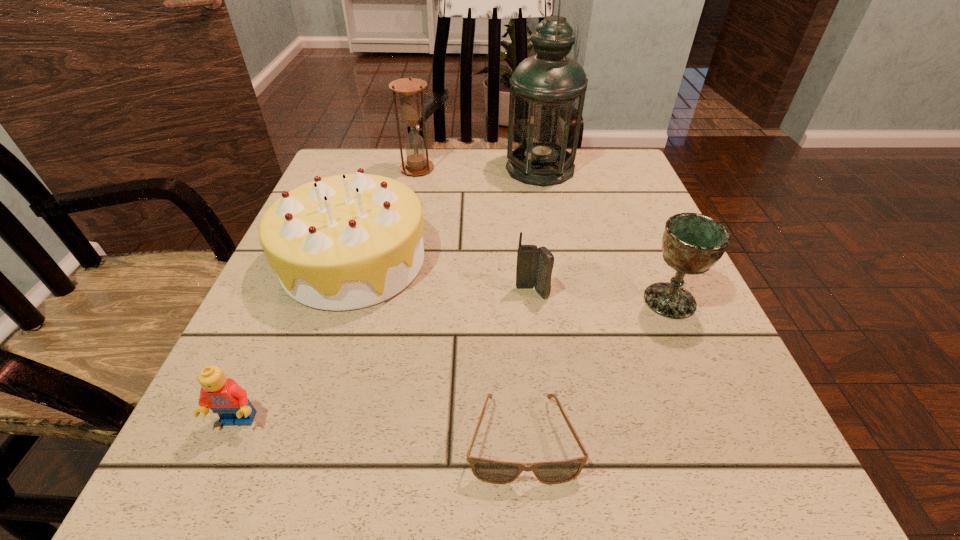
Locate an element on the screen. object that is positioned at the far right corner is located at coordinates (547, 93).

Where is `vacant space at the far edge of the desktop`? This screenshot has height=540, width=960. vacant space at the far edge of the desktop is located at coordinates (430, 156).

I want to click on vacant space at the near edge, so click(x=314, y=485).

This screenshot has height=540, width=960. Identify the location of free space at the right edge. pyautogui.click(x=616, y=303).

In the image, there is a desktop. Where is `vacant space at the near left corner`? The width and height of the screenshot is (960, 540). vacant space at the near left corner is located at coordinates (302, 440).

Identify the location of blank area at the near right corner. This screenshot has height=540, width=960. (680, 461).

Locate an element on the screen. free area in between the birthday cake and the sunglasses is located at coordinates (439, 349).

Find the location of a particular element. The height and width of the screenshot is (540, 960). vacant area between the cellular telephone and the oil lamp is located at coordinates (536, 231).

You are a GUI agent. You are given a task and a screenshot of the screen. Output one action in this format:
    pyautogui.click(x=<x>, y=<y>)
    Task: Click on the free space that is in between the shortest object and the Lego
    The height and width of the screenshot is (540, 960).
    Given the screenshot: What is the action you would take?
    pyautogui.click(x=380, y=430)

This screenshot has width=960, height=540. Identify the location of vacant area between the tallest object and the sunglasses. (532, 303).